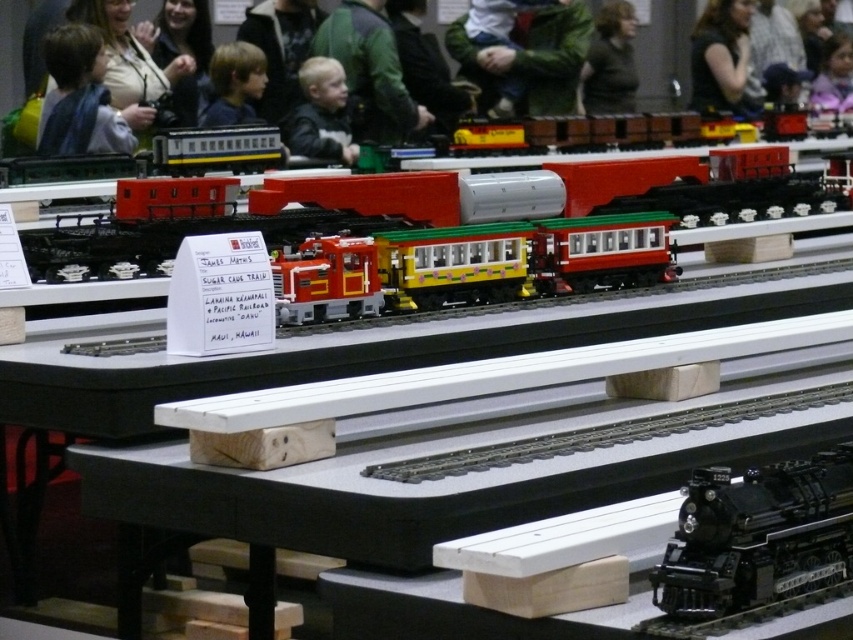
You are a photographer at the model train exhibition. You want to capture a photo that includes both the dark brown hair at upper right and the blonde hair at center. Which person should you position closer to the camera to ensure both fit in the frame?

Since the dark brown hair at upper right is wider than the blonde hair at center, you should position the person with the dark brown hair at upper right closer to the camera to ensure both fit in the frame.

You are a photographer at the train exhibition. You want to take a photo of the dark brown hair at upper right and the blonde hair at center so that both are visible in the frame. Which person should be closer to the left side of the photo?

The blonde hair at center should be closer to the left side of the photo because the dark brown hair at upper right is positioned on the right side of blonde hair at center.

You are standing in front of the model train display. There is a point marked at coordinates point (80, 99). What color is the fabric at that point?

The point (80, 99) is on blue fabric at upper left.